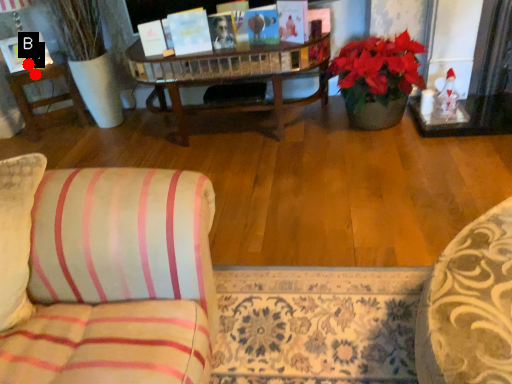
Question: Two points are circled on the image, labeled by A and B beside each circle. Which point is closer to the camera taking this photo?

Choices:
 (A) A is closer
 (B) B is closer

Answer: (B)